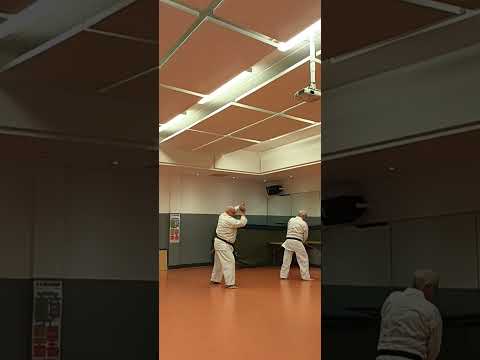
Locate an element on the screen. The image size is (480, 360). light is located at coordinates coord(287,56).